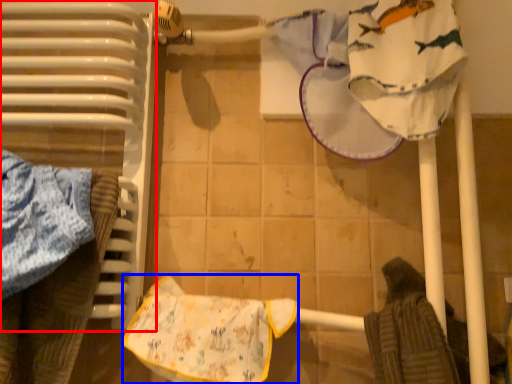
Question: Which of the following is the closest to the observer, radiator (highlighted by a red box) or material (highlighted by a blue box)?

Choices:
 (A) radiator
 (B) material

Answer: (A)